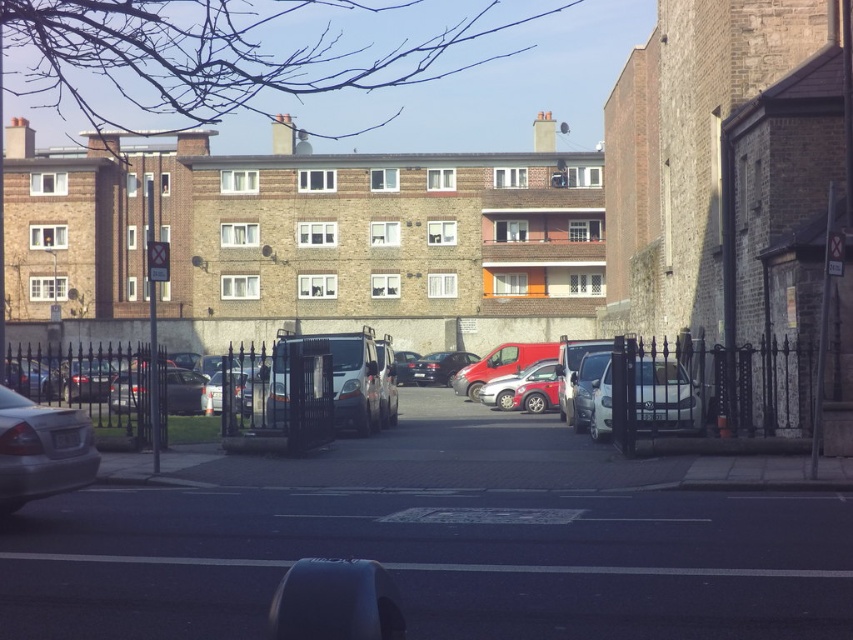
Question: Is silver metallic sedan at lower left bigger than white matte van at center?

Choices:
 (A) yes
 (B) no

Answer: (B)

Question: Which of the following is the farthest from the observer?

Choices:
 (A) (73, 481)
 (B) (581, 600)

Answer: (A)

Question: Which point is farther to the camera?

Choices:
 (A) metallic gray parking meter at lower center
 (B) shiny black sedan at center

Answer: (B)

Question: Is metallic gray parking meter at lower center wider than silver metallic sedan at lower left?

Choices:
 (A) yes
 (B) no

Answer: (A)

Question: Is silver metallic sedan at lower left positioned at the back of white matte van at center?

Choices:
 (A) no
 (B) yes

Answer: (A)

Question: Based on their relative distances, which object is farther from the shiny black sedan at center?

Choices:
 (A) white matte van at center
 (B) metallic gray parking meter at lower center
 (C) silver metallic sedan at lower left

Answer: (B)